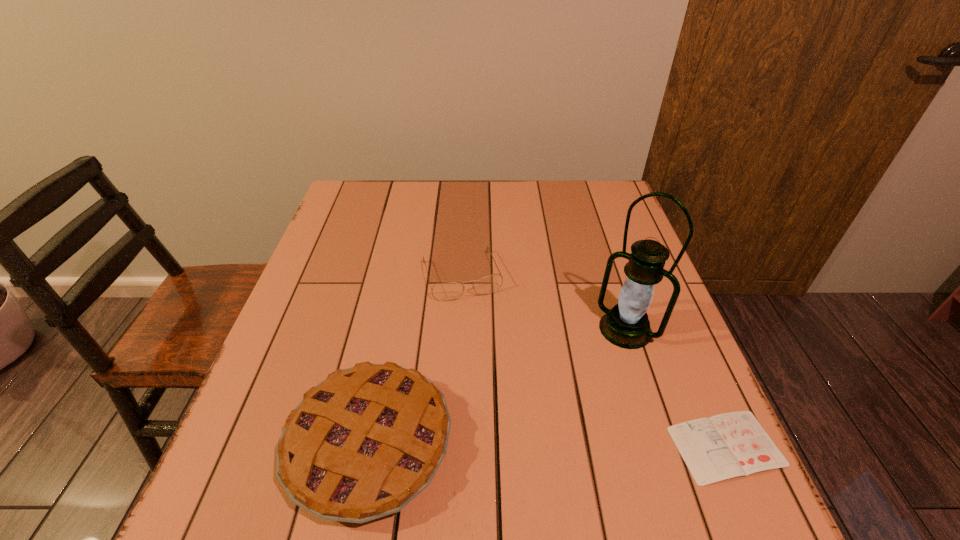
Where is `vacant spot on the desktop that is between the pie and the diary and is positioned on the side where the tallest object emits light`? vacant spot on the desktop that is between the pie and the diary and is positioned on the side where the tallest object emits light is located at coordinates pos(528,445).

Where is `vacant spot on the desktop that is between the third shortest object and the diary and is positioned on the front-facing side of the third tallest object`? This screenshot has width=960, height=540. vacant spot on the desktop that is between the third shortest object and the diary and is positioned on the front-facing side of the third tallest object is located at coordinates (517, 445).